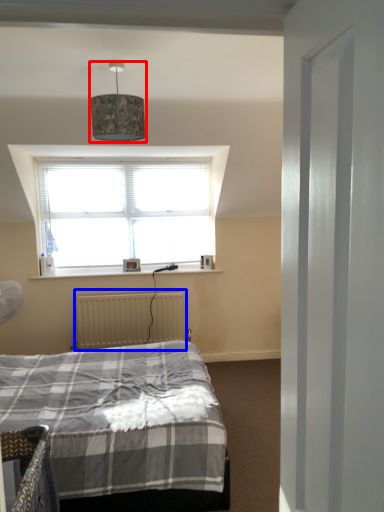
Question: Which point is closer to the camera, lamp (highlighted by a red box) or radiator (highlighted by a blue box)?

Choices:
 (A) lamp
 (B) radiator

Answer: (A)